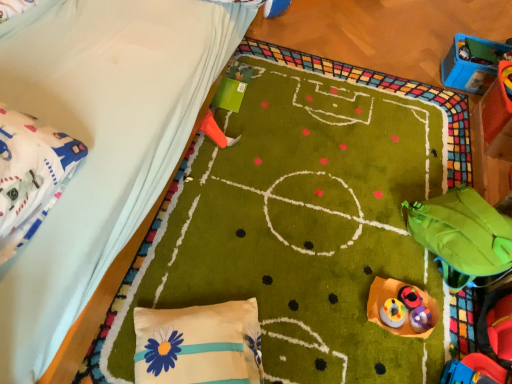
Image resolution: width=512 pixels, height=384 pixels. In order to click on free point to the right of rubberized yellow toy at center, the 5th toy in the back-to-front sequence in this screenshot , I will do `click(417, 321)`.